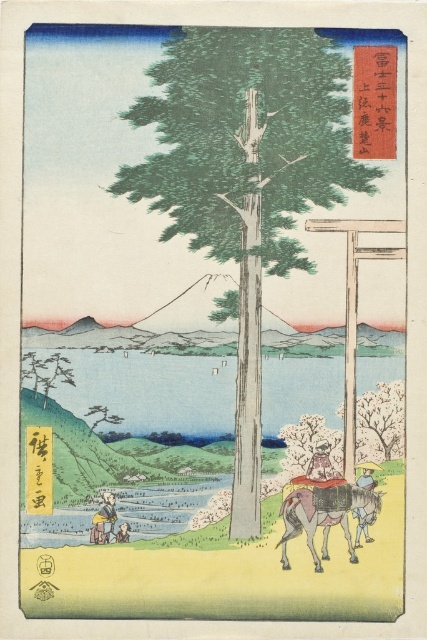
Question: Which point is closer to the camera taking this photo?

Choices:
 (A) (360, 509)
 (B) (20, 376)
 (C) (370, 486)
 (D) (307, 467)

Answer: (B)

Question: Is cherry blossom tree at center thinner than green matte tree at lower left?

Choices:
 (A) no
 (B) yes

Answer: (A)

Question: Can you confirm if green matte tree at lower left is thinner than light brown paper bag at lower center?

Choices:
 (A) no
 (B) yes

Answer: (A)

Question: From the image, what is the correct spatial relationship of green textured tree at center in relation to light brown paper bag at lower center?

Choices:
 (A) above
 (B) below

Answer: (A)

Question: Among these objects, which one is nearest to the camera?

Choices:
 (A) light blue fabric at lower right
 (B) light brown paper bag at lower center
 (C) green textured tree at center
 (D) green matte tree at lower left

Answer: (B)

Question: Which object appears closest to the camera in this image?

Choices:
 (A) light brown paper bag at lower center
 (B) green textured tree at center
 (C) wooden figure at center
 (D) brown textured donkey at lower center

Answer: (A)